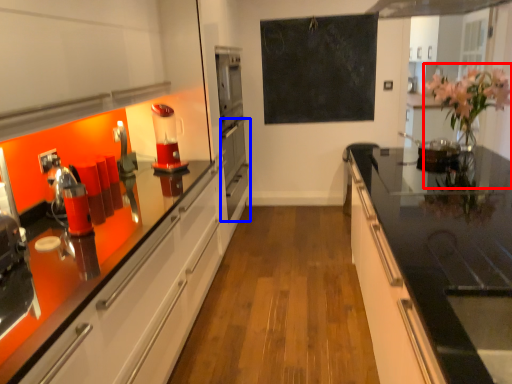
Question: Among these objects, which one is farthest to the camera, floral arrangement (highlighted by a red box) or oven (highlighted by a blue box)?

Choices:
 (A) floral arrangement
 (B) oven

Answer: (B)